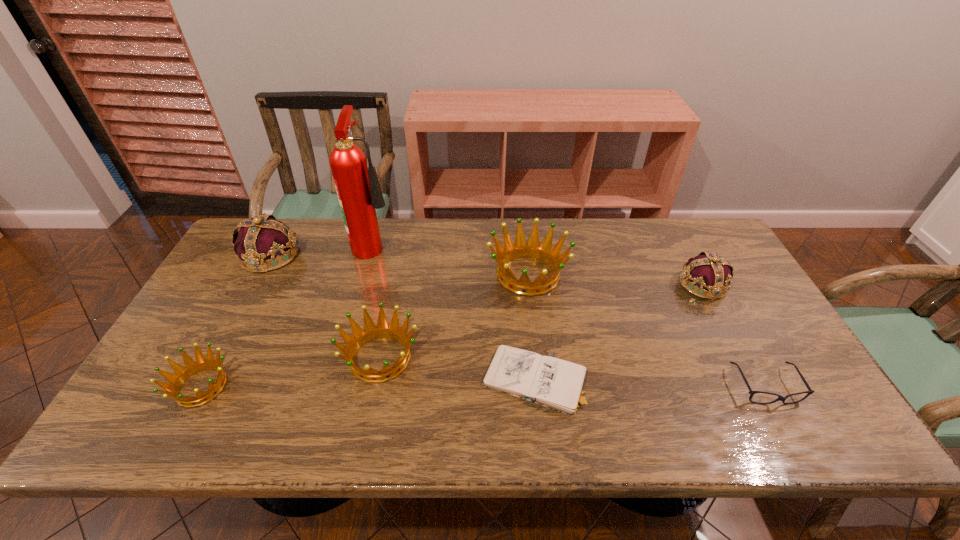
Where is `object situated at the near right corner`? object situated at the near right corner is located at coordinates (780, 398).

Where is `vacant space at the far edge`? vacant space at the far edge is located at coordinates (574, 228).

Locate an element on the screen. This screenshot has height=540, width=960. vacant area at the near edge of the desktop is located at coordinates (755, 423).

Image resolution: width=960 pixels, height=540 pixels. Identify the location of vacant area at the left edge of the desktop. (220, 293).

Where is `vacant space at the right edge of the desktop`? vacant space at the right edge of the desktop is located at coordinates (707, 308).

Where is `free location at the far right corner`? The width and height of the screenshot is (960, 540). free location at the far right corner is located at coordinates (665, 230).

At what (x,y) coordinates should I click in order to perform the action: click on free space between the second shortest object and the biggest golden crown. Please return your answer as a coordinate pair (x, y). This screenshot has width=960, height=540. Looking at the image, I should click on (647, 330).

Where is `vacant area that lies between the left purple crown and the farthest golden crown`? The height and width of the screenshot is (540, 960). vacant area that lies between the left purple crown and the farthest golden crown is located at coordinates (399, 265).

Find the location of a particular element. The width and height of the screenshot is (960, 540). vacant area that lies between the right purple crown and the seventh shortest object is located at coordinates (487, 270).

Find the location of a particular element. The image size is (960, 540). free space between the tallest object and the smaller purple crown is located at coordinates (539, 264).